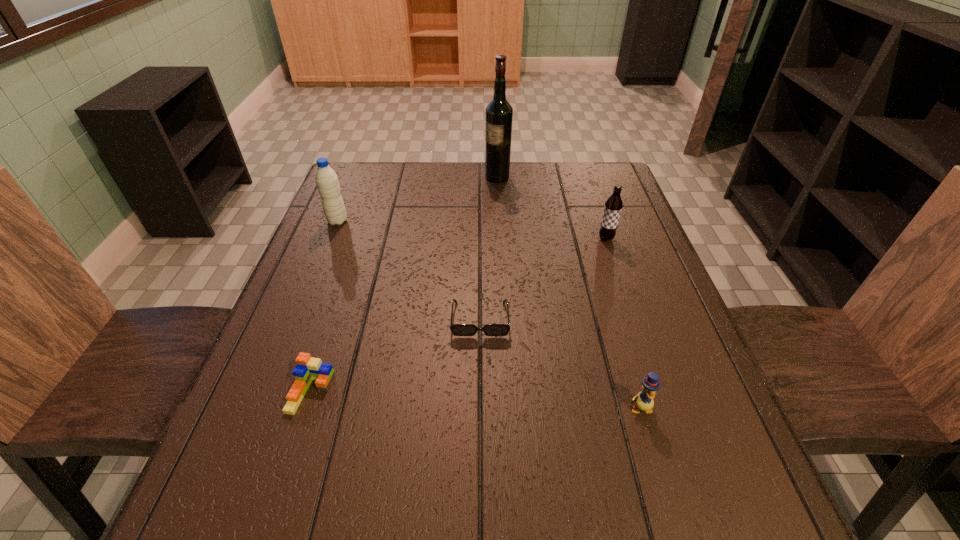
The image size is (960, 540). Identify the location of the shortest object. (457, 329).

I want to click on free region located on the front and back of the wine bottle, so click(x=381, y=177).

Find the location of a particular element. The width and height of the screenshot is (960, 540). vacant space situated 0.110m on the front and back of the wine bottle is located at coordinates (450, 177).

In order to click on blank area located 0.200m on the front and back of the wine bottle in this screenshot , I will do `click(422, 177)`.

You are a GUI agent. You are given a task and a screenshot of the screen. Output one action in this format:
    pyautogui.click(x=<x>, y=<y>)
    Task: Click on the vacant space located 0.140m on the front of the water bottle
    The width and height of the screenshot is (960, 540).
    Given the screenshot: What is the action you would take?
    pyautogui.click(x=322, y=260)

Identify the location of free spot located 0.300m on the front of the fourth nearest object. (637, 332).

Locate an element on the screen. vacant area situated 0.180m on the face of the duckling, where the monocle is placed is located at coordinates (675, 526).

Identify the location of vacant space located on the left of the Lego. (260, 392).

Locate an element on the screen. vacant space situated 0.090m on the front-facing side of the sunglasses is located at coordinates (480, 375).

Locate an element on the screen. The image size is (960, 540). object at the far edge is located at coordinates (499, 113).